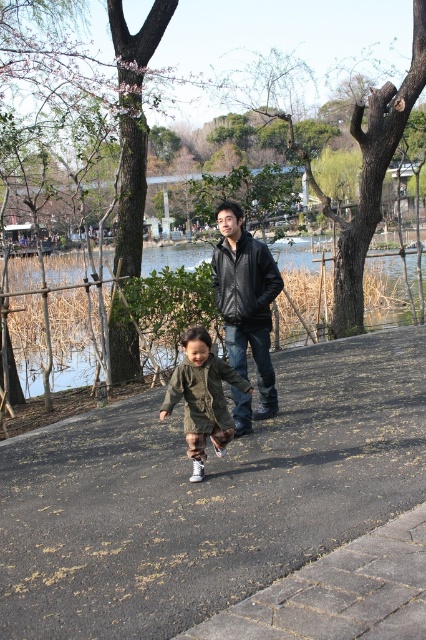
Who is taller, dark asphalt pavement at center or olive-green fabric jacket at center?

olive-green fabric jacket at center is taller.

Can you confirm if dark asphalt pavement at center is shorter than olive-green fabric jacket at center?

Yes, dark asphalt pavement at center is shorter than olive-green fabric jacket at center.

What are the coordinates of `dark asphalt pavement at center` in the screenshot? It's located at click(x=206, y=497).

Is asphalt at lower center to the right of black leather jacket at center from the viewer's perspective?

Yes, asphalt at lower center is to the right of black leather jacket at center.

Between asphalt at lower center and black leather jacket at center, which one is positioned lower?

asphalt at lower center is lower down.

Identify the location of asphalt at lower center. (339, 593).

Who is positioned more to the left, dark asphalt pavement at center or asphalt at lower center?

From the viewer's perspective, dark asphalt pavement at center appears more on the left side.

Does point (417, 342) lie in front of point (305, 620)?

No, it is behind (305, 620).

Where is `dark asphalt pavement at center`? dark asphalt pavement at center is located at coordinates (206, 497).